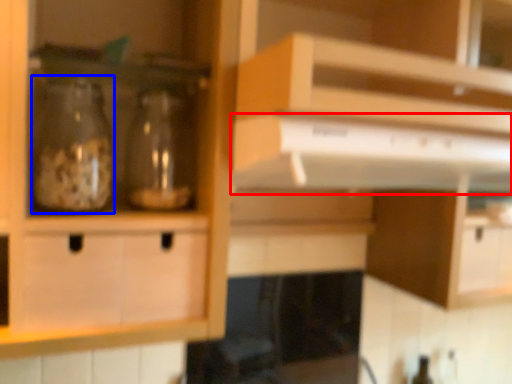
Question: Which object is further to the camera taking this photo, exhaust hood (highlighted by a red box) or glass bottle (highlighted by a blue box)?

Choices:
 (A) exhaust hood
 (B) glass bottle

Answer: (B)